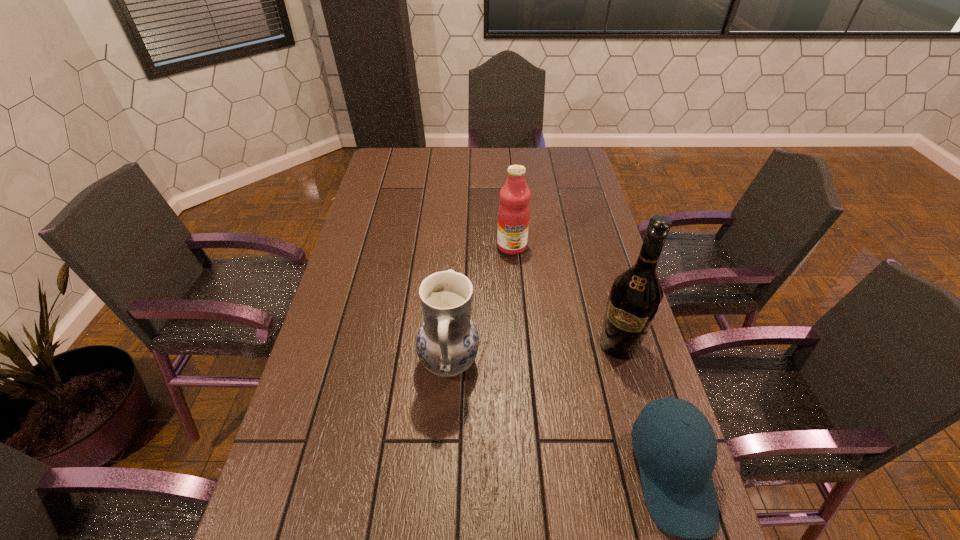
Locate an element on the screen. Image resolution: width=960 pixels, height=540 pixels. the leftmost object is located at coordinates (447, 342).

Where is `the third object from right to left`? the third object from right to left is located at coordinates (513, 215).

This screenshot has height=540, width=960. What are the coordinates of `fruit juice` in the screenshot? It's located at (513, 215).

At what (x,y) coordinates should I click in order to perform the action: click on wine bottle. Please return your answer as a coordinate pair (x, y). The height and width of the screenshot is (540, 960). Looking at the image, I should click on (635, 297).

Where is `blank space located 0.140m on the left of the leftmost object`? This screenshot has width=960, height=540. blank space located 0.140m on the left of the leftmost object is located at coordinates (367, 362).

At what (x,y) coordinates should I click in order to perform the action: click on free space located on the label of the fruit juice. Please return your answer as a coordinate pair (x, y). This screenshot has width=960, height=540. Looking at the image, I should click on (516, 345).

Where is `vacant area located 0.110m on the label of the fruit juice`? vacant area located 0.110m on the label of the fruit juice is located at coordinates (513, 279).

You are a GUI agent. You are given a task and a screenshot of the screen. Output one action in this format:
    pyautogui.click(x=<x>, y=<y>)
    Task: Click on the free location located 0.270m on the label of the fruit juice
    Image resolution: width=960 pixels, height=540 pixels.
    Given the screenshot: What is the action you would take?
    pyautogui.click(x=515, y=318)

Locate an element on the screen. The width and height of the screenshot is (960, 540). blank space located 0.370m on the label of the tallest object is located at coordinates (549, 481).

This screenshot has height=540, width=960. I want to click on free space located on the label of the tallest object, so click(x=576, y=429).